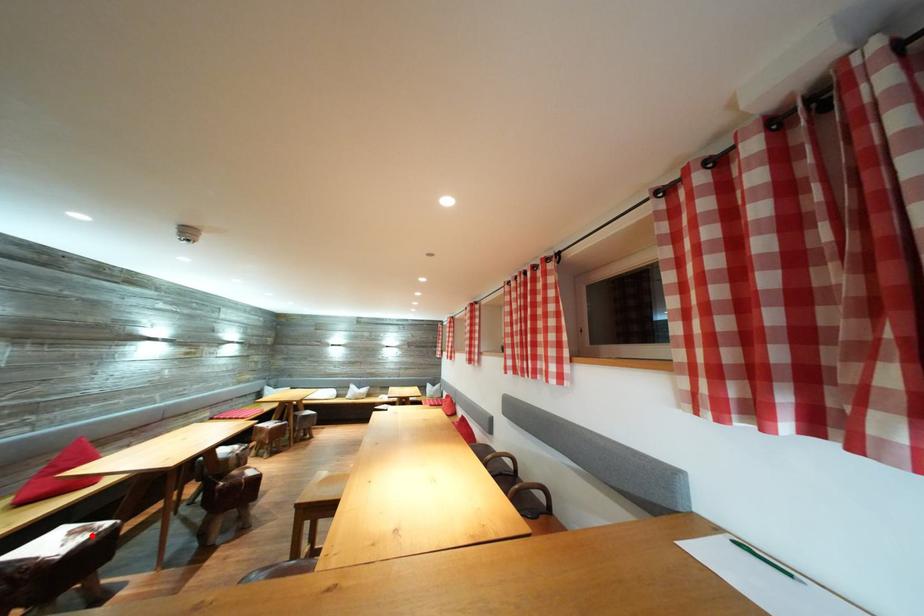
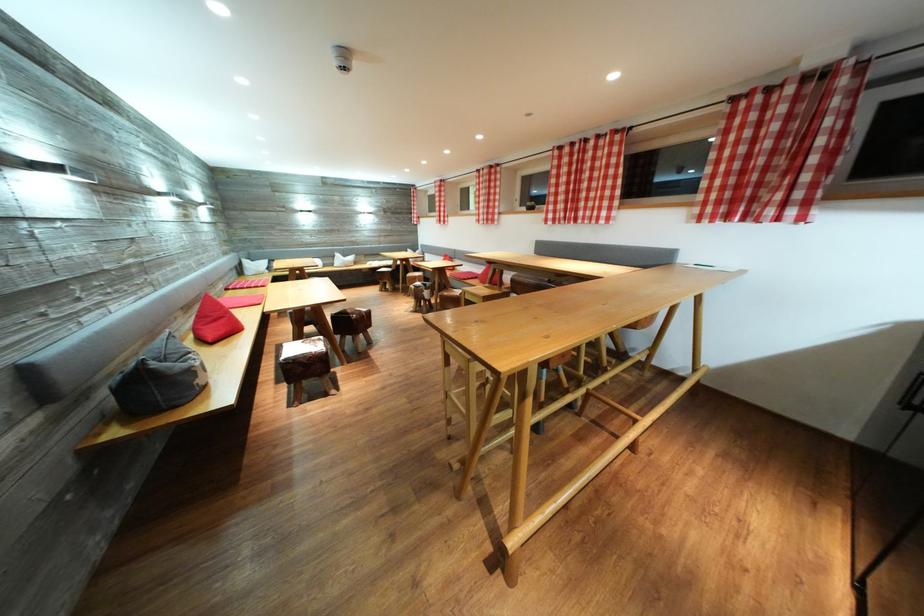
Question: I am providing you with two images of the same scene from different viewpoints. Image1 has a red point marked. In image2, the corresponding 3D location appears at what relative position? Reply with the corresponding letter.

Choices:
 (A) Closer
 (B) Farther

Answer: (A)